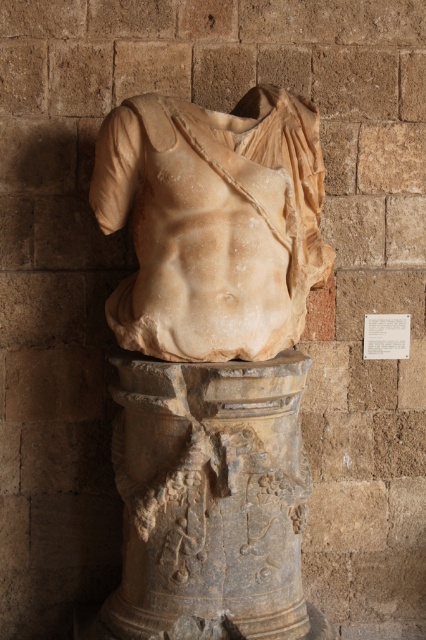
You are an art conservator examining the ancient marble bust. You notice two points on the sculpture, point (178,172) and point (154,554). Which point is nearer to you when you are standing in front of the bust?

Point (178,172) is closer to the viewer than point (154,554).

You are standing in front of the ancient marble bust displayed against the rustic stone wall. You notice two parts of the statue labeled as the marble statue at center and the marble statue torso at center. Which part is positioned closer to you?

The marble statue at center is closer to the viewer than the marble statue torso at center.